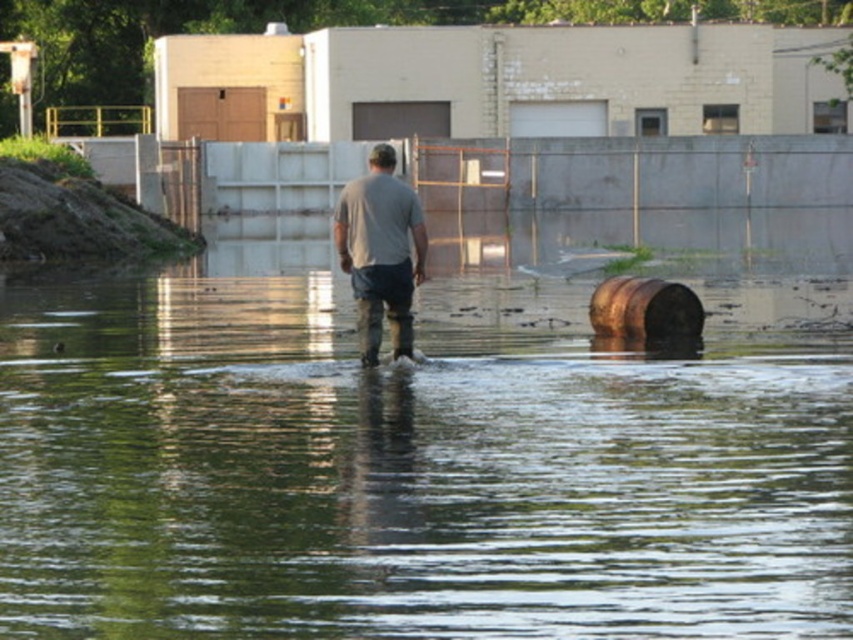
In the scene shown: You are a delivery person trying to cross the flooded area. You see the clear water at center and the gray matte shirt at center. Which one is wider?

The clear water at center is wider than the gray matte shirt at center.

You are a photographer trying to capture a shot of the gray matte shirt at center and the clear water at center. From your current position, which object is positioned to the right of the other?

The clear water at center is to the right of the gray matte shirt at center.

You are a drone operator trying to capture a closeup of the clear water at center. According to the coordinates provided, where should you direct the drone to focus?

The clear water at center is located at point (405, 474), so the drone should focus there to capture the closeup.